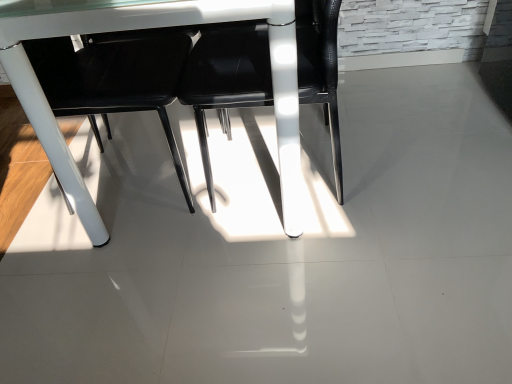
Where is `vacant space to the right of white glossy table at center`? vacant space to the right of white glossy table at center is located at coordinates (414, 144).